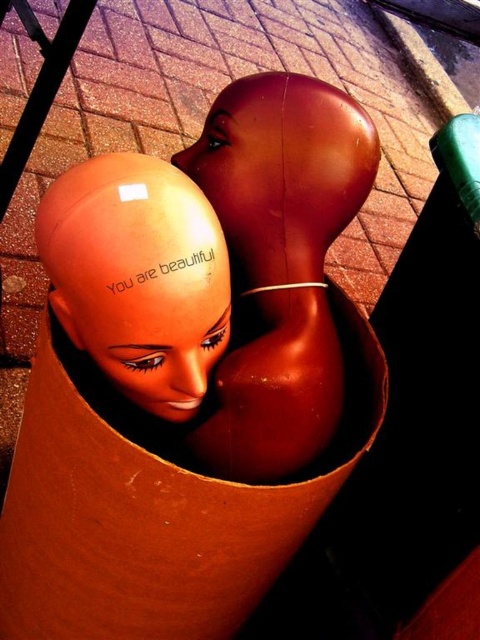
Between glossy brown mannequin head at center and glossy plastic head at center, which one appears on the right side from the viewer's perspective?

glossy brown mannequin head at center is more to the right.

Does glossy brown mannequin head at center come behind glossy plastic head at center?

No, glossy brown mannequin head at center is closer to the viewer.

Is point (336, 400) behind point (263, 116)?

Yes, point (336, 400) is farther from viewer.

Identify the location of glossy brown mannequin head at center. The image size is (480, 640). (279, 260).

Is glossy brown mannequin head at center shorter than matte orange head at center?

No, glossy brown mannequin head at center is not shorter than matte orange head at center.

Which is below, glossy brown mannequin head at center or matte orange head at center?

matte orange head at center

You are a GUI agent. You are given a task and a screenshot of the screen. Output one action in this format:
    pyautogui.click(x=<x>, y=<y>)
    Task: Click on the glossy brown mannequin head at center
    Image resolution: width=480 pixels, height=640 pixels.
    Given the screenshot: What is the action you would take?
    pyautogui.click(x=279, y=260)

Is matte orange head at center thinner than glossy plastic head at center?

In fact, matte orange head at center might be wider than glossy plastic head at center.

Who is positioned more to the right, matte orange head at center or glossy plastic head at center?

Positioned to the right is glossy plastic head at center.

Is point (206, 337) farther from camera compared to point (226, 176)?

No, (206, 337) is closer to viewer.

At what (x,y) coordinates should I click in order to perform the action: click on matte orange head at center. Please return your answer as a coordinate pair (x, y). This screenshot has width=480, height=640. Looking at the image, I should click on (158, 346).